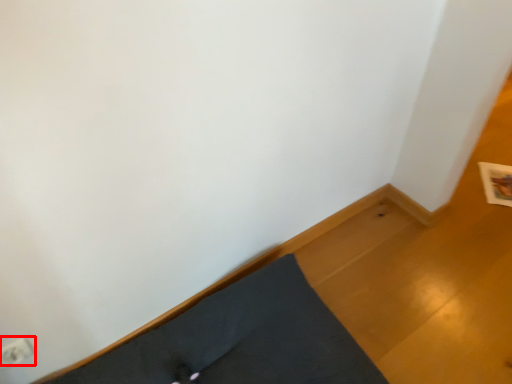
Question: From the image's perspective, what is the correct spatial relationship of electric outlet (annotated by the red box) in relation to bed frame?

Choices:
 (A) below
 (B) above

Answer: (B)